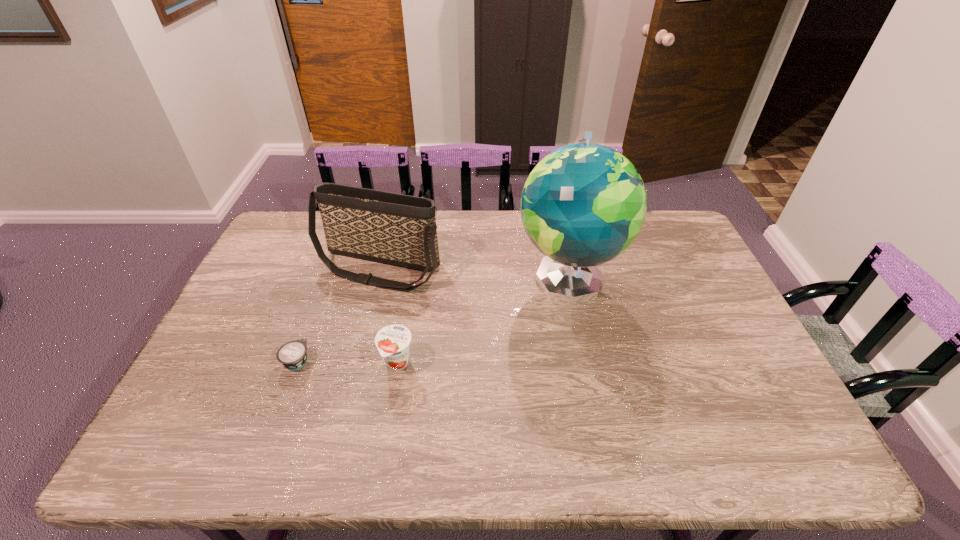
This screenshot has width=960, height=540. What are the coordinates of `the rightmost object` in the screenshot? It's located at (584, 204).

Where is `globe`? globe is located at coordinates point(584,204).

Locate an element on the screen. the third shortest object is located at coordinates (391, 228).

This screenshot has width=960, height=540. Find the location of `the right yogurt`. the right yogurt is located at coordinates (393, 342).

Where is `the taller yogurt`? the taller yogurt is located at coordinates (393, 342).

Where is `the shorter yogurt`? the shorter yogurt is located at coordinates (292, 355).

The height and width of the screenshot is (540, 960). In order to click on the shortest object in this screenshot , I will do `click(292, 355)`.

Find the location of a particular element. Image resolution: width=960 pixels, height=540 pixels. vacant space positioned on the front surface of the rightmost object is located at coordinates (603, 443).

Where is `vacant space located on the right of the handbag`? This screenshot has height=540, width=960. vacant space located on the right of the handbag is located at coordinates (535, 267).

The height and width of the screenshot is (540, 960). In order to click on vacant space located on the right of the right yogurt in this screenshot , I will do `click(456, 363)`.